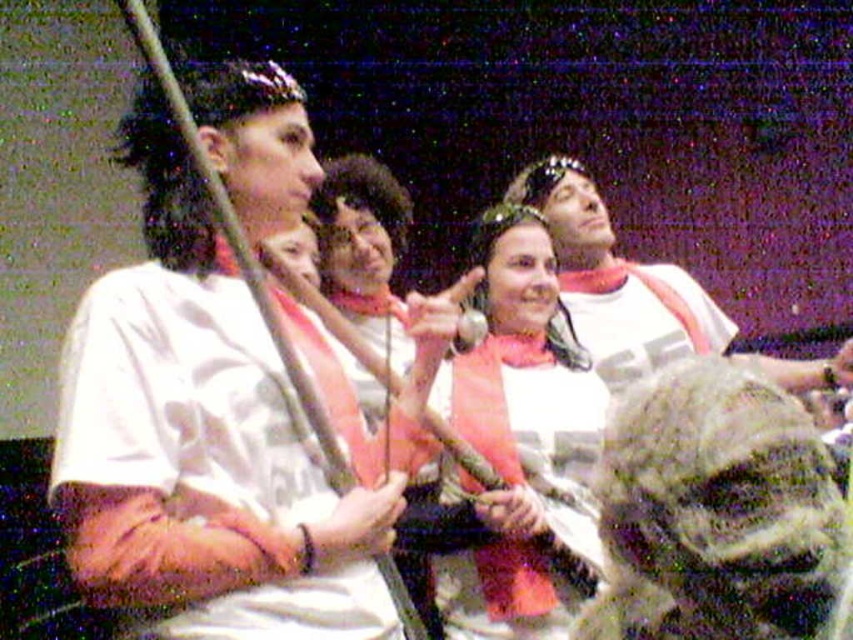
You are a stagehand setting up for a performance and need to place a matte black sword at center and a camo fabric shirt at center on a shelf. Since the shelf has limited vertical space, which object should you place first to ensure both fit without exceeding the shelf height?

The matte black sword at center has a greater height compared to the camo fabric shirt at center. To ensure both fit on the shelf, you should place the taller matte black sword at center first, then position the shorter camo fabric shirt at center on top or alongside it, ensuring total height doesn

You are a stagehand setting up for a performance. You need to place the matte black sword at center and the camo fabric shirt at center on a narrow shelf. Which object should you place first to ensure both fit on the shelf?

The matte black sword at center has a lesser width compared to the camo fabric shirt at center, so you should place the wider camo fabric shirt at center first to ensure both items fit on the narrow shelf.